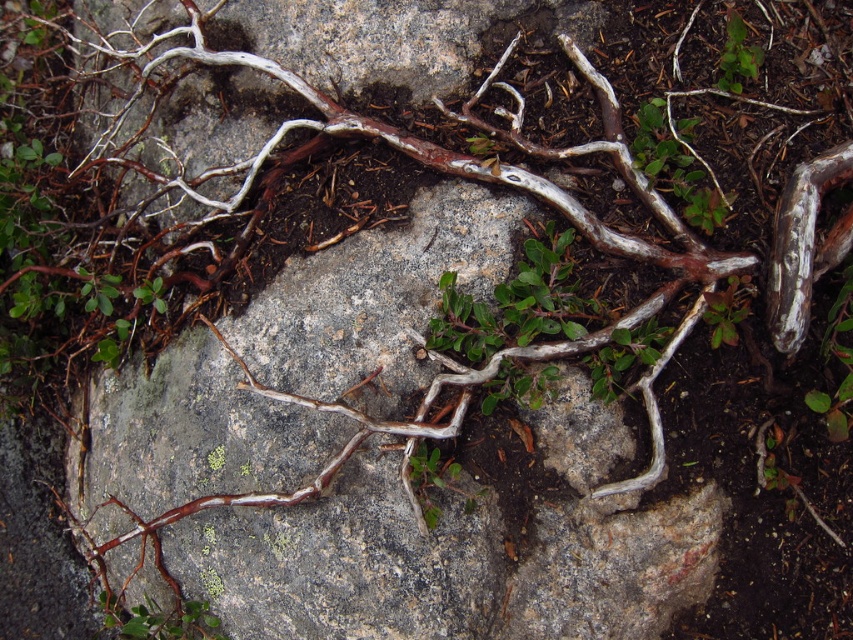
Question: Can you confirm if green matte plant at lower left is wider than green leafy plant at upper right?

Choices:
 (A) yes
 (B) no

Answer: (A)

Question: Can you confirm if green matte plant at lower left is smaller than green leafy plant at upper right?

Choices:
 (A) yes
 (B) no

Answer: (B)

Question: Does green matte plant at lower left lie behind green leafy plant at upper right?

Choices:
 (A) no
 (B) yes

Answer: (B)

Question: Which point appears closest to the camera in this image?

Choices:
 (A) (746, 61)
 (B) (109, 596)

Answer: (A)